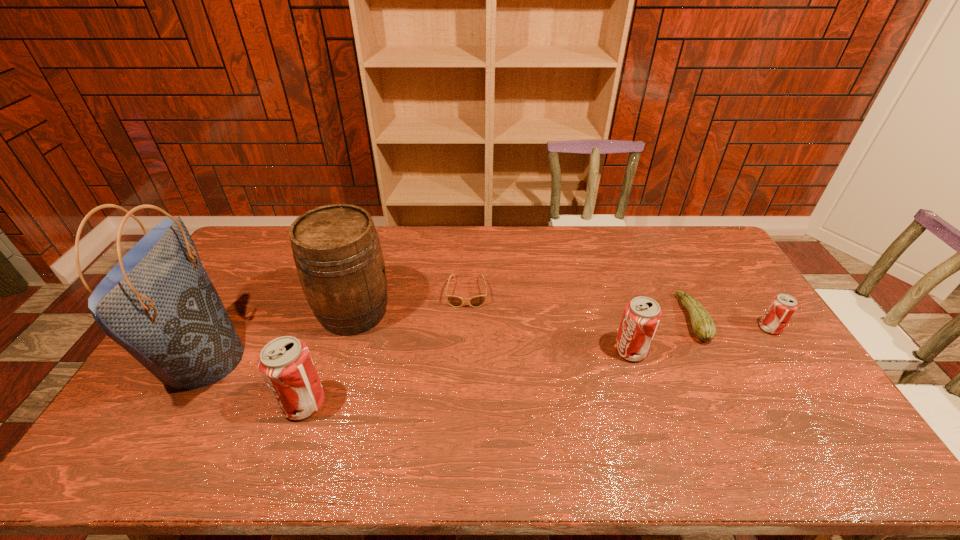
To make them evenly spaced by inserting another pop_(soda) among them, please locate a free space for this new pop_(soda). Please provide its 2D coordinates. Your answer should be formatted as a tuple, i.e. [(x, y)], where the tuple contains the x and y coordinates of a point satisfying the conditions above.

[(476, 376)]